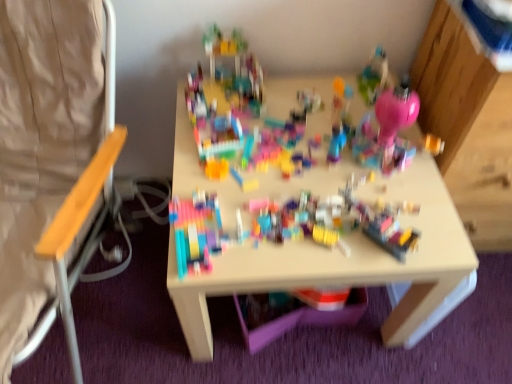
Locate an element on the screen. Image resolution: width=512 pixels, height=384 pixels. translucent plastic container at center, which is counted as the 1th toy, starting from the back is located at coordinates (388, 231).

Image resolution: width=512 pixels, height=384 pixels. Identify the location of wooden seat at left. (42, 142).

Where is `multicolored plastic blocks at center, which is counted as the 1th toy, starting from the front`? This screenshot has width=512, height=384. multicolored plastic blocks at center, which is counted as the 1th toy, starting from the front is located at coordinates (274, 157).

Locate an element on the screen. The height and width of the screenshot is (384, 512). translucent plastic container at center, which is the 2th toy in top-to-bottom order is located at coordinates (388, 231).

From the image's perspective, between translucent plastic container at center, the 2th toy in the front-to-back sequence, and wooden seat at left, which one is located above?

wooden seat at left.

Is translucent plastic container at center, the 2th toy in the front-to-back sequence, inside the boundaries of wooden seat at left, or outside?

translucent plastic container at center, the 2th toy in the front-to-back sequence, is spatially situated outside wooden seat at left.

Is translucent plastic container at center, which appears as the second toy when viewed from the left, facing towards wooden seat at left?

No, translucent plastic container at center, which appears as the second toy when viewed from the left, does not turn towards wooden seat at left.

What are the coordinates of `toy above the wooden seat at left (from a real-world perspective)` in the screenshot? It's located at (388, 231).

You are a GUI agent. You are given a task and a screenshot of the screen. Output one action in this format:
    pyautogui.click(x=<x>, y=<y>)
    Task: Click on the folding chair in front of the multicolored plastic blocks at center, which is counted as the 1th toy, starting from the front
    The width and height of the screenshot is (512, 384).
    Given the screenshot: What is the action you would take?
    pyautogui.click(x=42, y=142)

Is wooden seat at left not close to multicolored plastic blocks at center, positioned as the first toy in left-to-right order?

wooden seat at left is near multicolored plastic blocks at center, positioned as the first toy in left-to-right order, not far away.

Would you say wooden seat at left is outside multicolored plastic blocks at center, the 2th toy positioned from the right?

That's correct, wooden seat at left is outside of multicolored plastic blocks at center, the 2th toy positioned from the right.

Does point (293, 165) appear closer or farther from the camera than point (94, 4)?

Point (293, 165) appears to be farther away from the viewer than point (94, 4).

How many degrees apart are the facing directions of multicolored plastic blocks at center, positioned as the first toy in left-to-right order, and wooden seat at left?

There is a 0.183-degree angle between the facing directions of multicolored plastic blocks at center, positioned as the first toy in left-to-right order, and wooden seat at left.

From the image's perspective, is multicolored plastic blocks at center, which is counted as the 1th toy, starting from the front, above or below wooden seat at left?

multicolored plastic blocks at center, which is counted as the 1th toy, starting from the front, is situated lower than wooden seat at left in the image.

Is multicolored plastic blocks at center, which is the 2th toy in back-to-front order, directly adjacent to wooden seat at left?

There is a gap between multicolored plastic blocks at center, which is the 2th toy in back-to-front order, and wooden seat at left.

Considering their positions, is translucent plastic container at center, the first toy when ordered from bottom to top, located in front of or behind multicolored plastic blocks at center, which is the 2th toy from bottom to top?

translucent plastic container at center, the first toy when ordered from bottom to top, is behind multicolored plastic blocks at center, which is the 2th toy from bottom to top.

Is there a large distance between translucent plastic container at center, which appears as the second toy when viewed from the left, and multicolored plastic blocks at center, the 1th toy positioned from the top?

translucent plastic container at center, which appears as the second toy when viewed from the left, is actually quite close to multicolored plastic blocks at center, the 1th toy positioned from the top.

From the image's perspective, is translucent plastic container at center, which is the 1th toy from right to left, positioned above or below multicolored plastic blocks at center, which is the 2th toy in back-to-front order?

translucent plastic container at center, which is the 1th toy from right to left, is below multicolored plastic blocks at center, which is the 2th toy in back-to-front order.

Is translucent plastic container at center, the first toy when ordered from bottom to top, positioned beyond the bounds of multicolored plastic blocks at center, which is the 2th toy in back-to-front order?

Absolutely, translucent plastic container at center, the first toy when ordered from bottom to top, is external to multicolored plastic blocks at center, which is the 2th toy in back-to-front order.

From a real-world perspective, which is physically below, wooden seat at left or translucent plastic container at center, which is counted as the 1th toy, starting from the back?

wooden seat at left is physically lower.

From the image's perspective, is wooden seat at left over translucent plastic container at center, which is the 1th toy from right to left?

Correct, wooden seat at left appears higher than translucent plastic container at center, which is the 1th toy from right to left, in the image.

Locate an element on the screen. The width and height of the screenshot is (512, 384). folding chair above the translucent plastic container at center, which is counted as the 1th toy, starting from the back (from the image's perspective) is located at coordinates (42, 142).

Could you tell me if wooden seat at left is turned towards translucent plastic container at center, which is the 2th toy in top-to-bottom order?

No, wooden seat at left does not turn towards translucent plastic container at center, which is the 2th toy in top-to-bottom order.

How different are the orientations of multicolored plastic blocks at center, which is the 2th toy in back-to-front order, and translucent plastic container at center, the 2th toy in the front-to-back sequence, in degrees?

There is a 45.9-degree angle between the facing directions of multicolored plastic blocks at center, which is the 2th toy in back-to-front order, and translucent plastic container at center, the 2th toy in the front-to-back sequence.

This screenshot has height=384, width=512. I want to click on toy behind the multicolored plastic blocks at center, which is the 2th toy in back-to-front order, so click(388, 231).

Is multicolored plastic blocks at center, positioned as the first toy in left-to-right order, oriented away from translucent plastic container at center, which appears as the second toy when viewed from the left?

No, multicolored plastic blocks at center, positioned as the first toy in left-to-right order,'s orientation is not away from translucent plastic container at center, which appears as the second toy when viewed from the left.

Does point (184, 192) come in front of point (399, 253)?

No, (184, 192) is behind (399, 253).

The image size is (512, 384). Find the location of `folding chair below the translucent plastic container at center, which appears as the second toy when viewed from the left (from a real-world perspective)`. folding chair below the translucent plastic container at center, which appears as the second toy when viewed from the left (from a real-world perspective) is located at coordinates (42, 142).

There is a wooden seat at left. Identify the location of the 1st toy below it (from the image's perspective). This screenshot has width=512, height=384. (274, 157).

From the image, which object appears to be farther from translucent plastic container at center, which appears as the second toy when viewed from the left, wooden seat at left or multicolored plastic blocks at center, the 1th toy positioned from the top?

wooden seat at left lies further to translucent plastic container at center, which appears as the second toy when viewed from the left, than the other object.

Looking at the image, which one is located closer to wooden seat at left, translucent plastic container at center, which is counted as the 1th toy, starting from the back, or multicolored plastic blocks at center, the 1th toy positioned from the top?

multicolored plastic blocks at center, the 1th toy positioned from the top.

From the image, which object appears to be nearer to multicolored plastic blocks at center, the 2th toy positioned from the right, translucent plastic container at center, which is the 1th toy from right to left, or wooden seat at left?

translucent plastic container at center, which is the 1th toy from right to left.

When comparing their distances from multicolored plastic blocks at center, the 1th toy positioned from the top, does wooden seat at left or translucent plastic container at center, the first toy when ordered from bottom to top, seem closer?

translucent plastic container at center, the first toy when ordered from bottom to top, is closer to multicolored plastic blocks at center, the 1th toy positioned from the top.

Which object lies further to the anchor point translucent plastic container at center, which is the 1th toy from right to left, multicolored plastic blocks at center, the 1th toy positioned from the top, or wooden seat at left?

Among the two, wooden seat at left is located further to translucent plastic container at center, which is the 1th toy from right to left.

When comparing their distances from wooden seat at left, does multicolored plastic blocks at center, the 1th toy positioned from the top, or translucent plastic container at center, which is the 2th toy in top-to-bottom order, seem further?

The object further to wooden seat at left is translucent plastic container at center, which is the 2th toy in top-to-bottom order.

Identify the location of toy situated between wooden seat at left and translucent plastic container at center, the first toy when ordered from bottom to top, from left to right. The height and width of the screenshot is (384, 512). (274, 157).